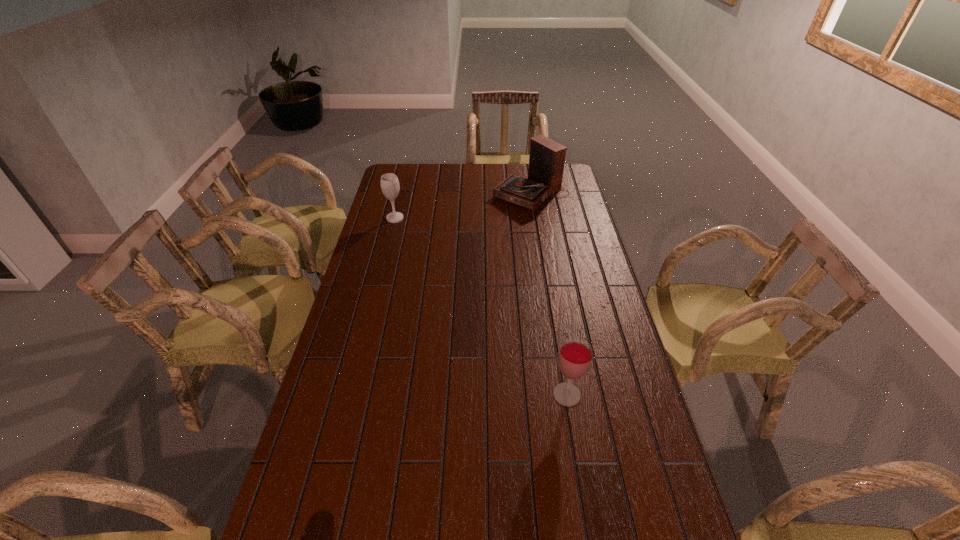
The width and height of the screenshot is (960, 540). I want to click on object that is at the right edge, so click(546, 160).

In order to click on object located at the far right corner in this screenshot , I will do `click(546, 160)`.

What are the coordinates of `blank space at the far edge of the desktop` in the screenshot? It's located at (513, 173).

The height and width of the screenshot is (540, 960). I want to click on free location at the left edge, so click(x=378, y=235).

What are the coordinates of `vacant space at the right edge` in the screenshot? It's located at (582, 213).

The width and height of the screenshot is (960, 540). I want to click on vacant region at the far left corner, so click(x=408, y=186).

At what (x,y) coordinates should I click in order to perform the action: click on vacant space that is in between the left wineglass and the right wineglass. Please return your answer as a coordinate pair (x, y). Looking at the image, I should click on (481, 306).

Find the location of `free space between the phonograph record and the nearer wineglass`. free space between the phonograph record and the nearer wineglass is located at coordinates (549, 294).

At what (x,y) coordinates should I click in order to perform the action: click on blank region between the nearer wineglass and the farthest object. Please return your answer as a coordinate pair (x, y). Looking at the image, I should click on (549, 294).

Where is `free space between the nearest object and the second nearest object`? This screenshot has height=540, width=960. free space between the nearest object and the second nearest object is located at coordinates (481, 306).